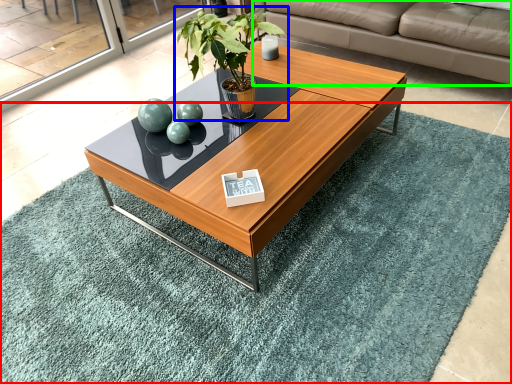
Question: Based on their relative distances, which object is farther from mat (highlighted by a red box)? Choose from houseplant (highlighted by a blue box) and studio couch (highlighted by a green box).

Choices:
 (A) houseplant
 (B) studio couch

Answer: (B)